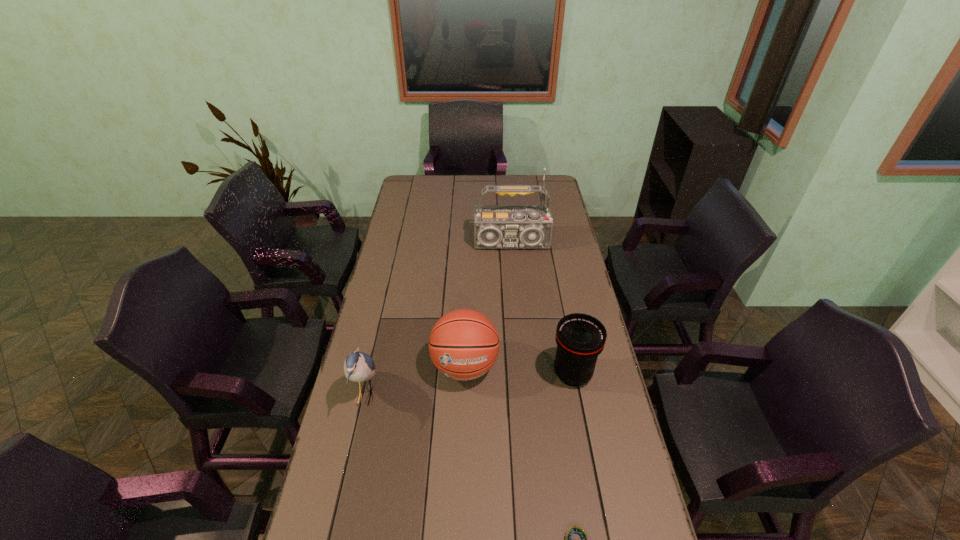
At what (x,y) coordinates should I click in order to perform the action: click on the farthest object. Please return your answer as a coordinate pair (x, y). The image size is (960, 540). Looking at the image, I should click on (495, 226).

The height and width of the screenshot is (540, 960). Find the location of `the tallest object`. the tallest object is located at coordinates (495, 226).

The height and width of the screenshot is (540, 960). Identify the location of basketball. (464, 344).

The width and height of the screenshot is (960, 540). Identify the location of the leftmost object. (358, 366).

Locate an element on the screen. telephoto lens is located at coordinates (580, 338).

Where is `vacant space situated 0.380m on the front-facing side of the radio receiver`? vacant space situated 0.380m on the front-facing side of the radio receiver is located at coordinates (519, 327).

Locate an element on the screen. free spot located 0.240m on the logo side of the basketball is located at coordinates (462, 472).

You are a GUI agent. You are given a task and a screenshot of the screen. Output one action in this format:
    pyautogui.click(x=<x>, y=<y>)
    Task: Click on the vacant space located 0.320m at the tip of the bird's beak
    The height and width of the screenshot is (540, 960).
    Given the screenshot: What is the action you would take?
    pyautogui.click(x=481, y=395)

The width and height of the screenshot is (960, 540). I want to click on vacant space situated on the back of the telephoto lens, so click(558, 296).

The image size is (960, 540). In order to click on object that is at the left edge in this screenshot , I will do `click(358, 366)`.